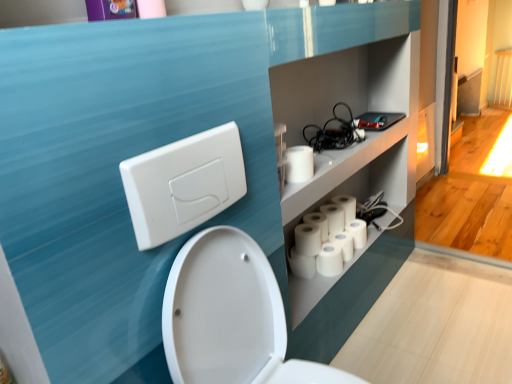
Identify the location of vacant area that is in front of white matte toilet paper at lower center, the 4th toilet paper in the back-to-front sequence. Image resolution: width=512 pixels, height=384 pixels. (298, 285).